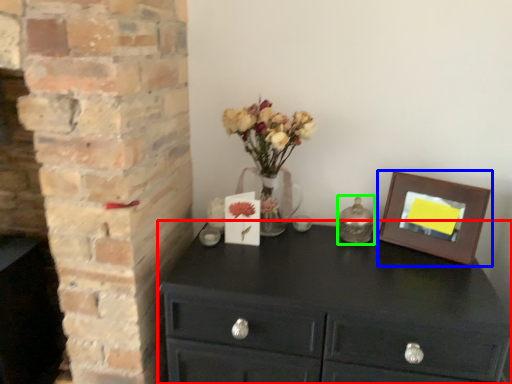
Question: Which object is positioned farthest from chest of drawers (highlighted by a red box)? Select from picture frame (highlighted by a blue box) and candle holder (highlighted by a green box).

Choices:
 (A) picture frame
 (B) candle holder

Answer: (B)